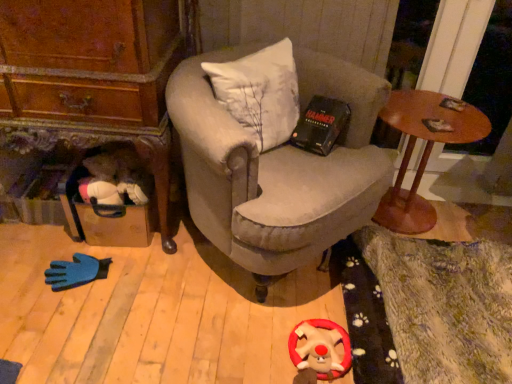
Question: Is velvet gray armchair at center at the left side of velvety red plush reindeer at lower center?

Choices:
 (A) yes
 (B) no

Answer: (A)

Question: Does velvet gray armchair at center have a lesser height compared to velvety red plush reindeer at lower center?

Choices:
 (A) no
 (B) yes

Answer: (A)

Question: From a real-world perspective, is velvet gray armchair at center on velvety red plush reindeer at lower center?

Choices:
 (A) no
 (B) yes

Answer: (B)

Question: Is velvet gray armchair at center not inside velvety red plush reindeer at lower center?

Choices:
 (A) yes
 (B) no

Answer: (A)

Question: Considering the relative positions of velvet gray armchair at center and velvety red plush reindeer at lower center in the image provided, is velvet gray armchair at center behind velvety red plush reindeer at lower center?

Choices:
 (A) no
 (B) yes

Answer: (A)

Question: Can you confirm if velvet gray armchair at center is bigger than velvety red plush reindeer at lower center?

Choices:
 (A) no
 (B) yes

Answer: (B)

Question: From a real-world perspective, is wooden round table at right on top of velvety red plush reindeer at lower center?

Choices:
 (A) yes
 (B) no

Answer: (A)

Question: Does wooden round table at right have a lesser width compared to velvety red plush reindeer at lower center?

Choices:
 (A) no
 (B) yes

Answer: (A)

Question: From the image's perspective, is wooden round table at right beneath velvety red plush reindeer at lower center?

Choices:
 (A) yes
 (B) no

Answer: (B)

Question: From a real-world perspective, is wooden round table at right physically below velvety red plush reindeer at lower center?

Choices:
 (A) yes
 (B) no

Answer: (B)

Question: Is wooden round table at right directly adjacent to velvety red plush reindeer at lower center?

Choices:
 (A) yes
 (B) no

Answer: (B)

Question: Is wooden round table at right taller than velvety red plush reindeer at lower center?

Choices:
 (A) yes
 (B) no

Answer: (A)

Question: Is wooden round table at right bigger than velvet gray armchair at center?

Choices:
 (A) yes
 (B) no

Answer: (B)